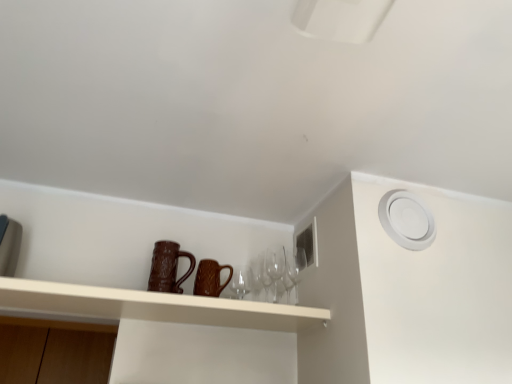
The height and width of the screenshot is (384, 512). In order to click on free space to the back side of transparent glass wine glasses at center, the 2th wine glass positioned from the right in this screenshot , I will do `click(273, 322)`.